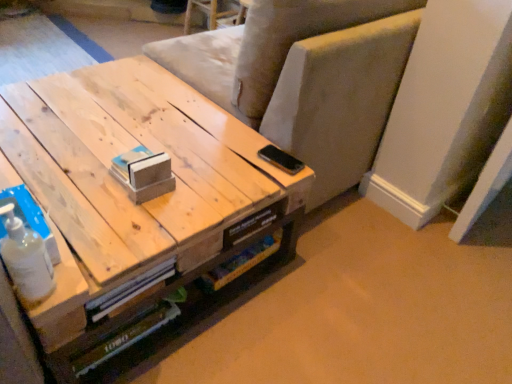
Question: Considering the positions of natural wood table at center and light beige fabric armchair at upper center in the image, is natural wood table at center wider or thinner than light beige fabric armchair at upper center?

Choices:
 (A) wide
 (B) thin

Answer: (A)

Question: Considering their positions, is natural wood table at center located in front of or behind light beige fabric armchair at upper center?

Choices:
 (A) behind
 (B) front

Answer: (B)

Question: Estimate the real-world distances between objects in this image. Which object is farther from the light beige fabric armchair at upper center?

Choices:
 (A) natural wood table at center
 (B) white matte bottle at lower left

Answer: (B)

Question: Which is farther from the white matte bottle at lower left?

Choices:
 (A) light beige fabric armchair at upper center
 (B) natural wood table at center

Answer: (A)